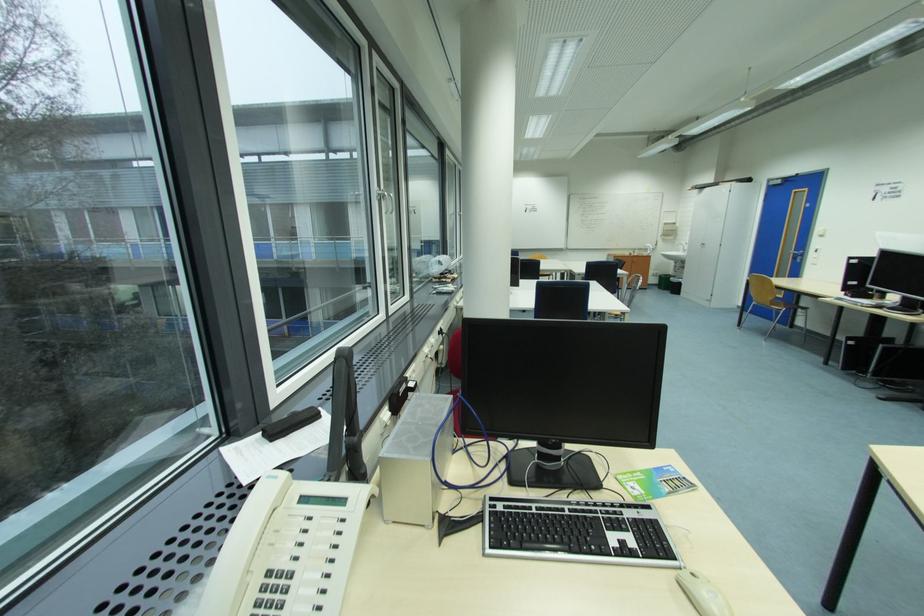
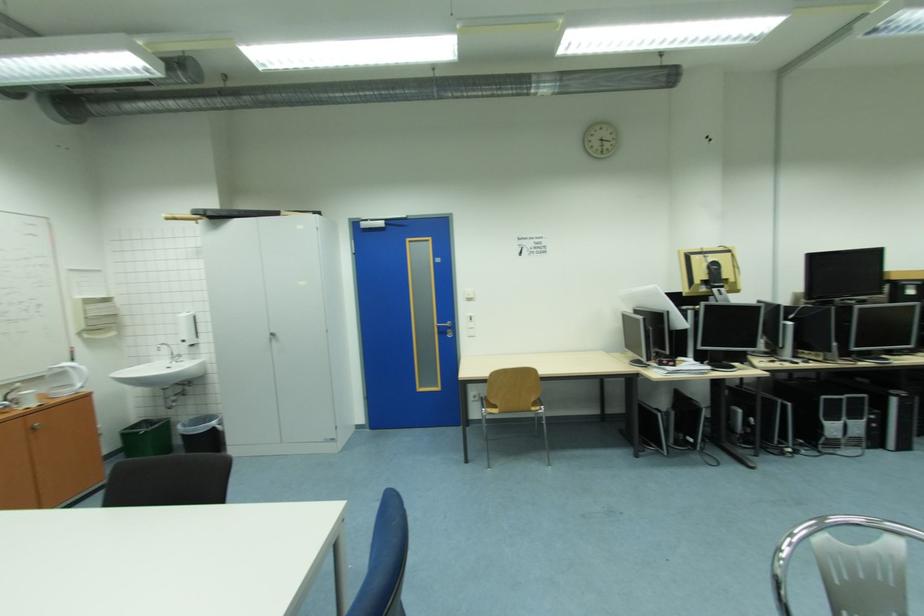
Find the pixel in the second image that matches (x=829, y=237) in the first image.

(477, 301)